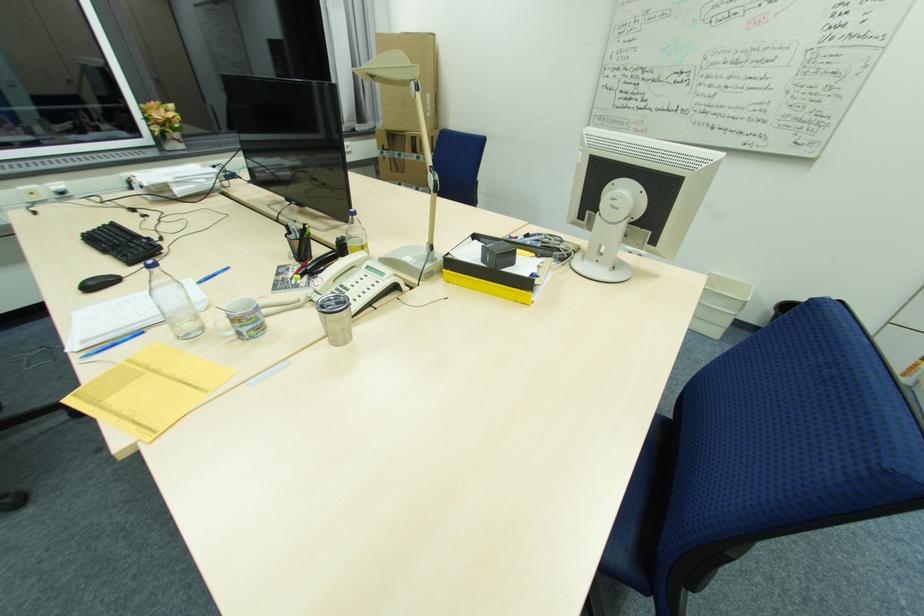
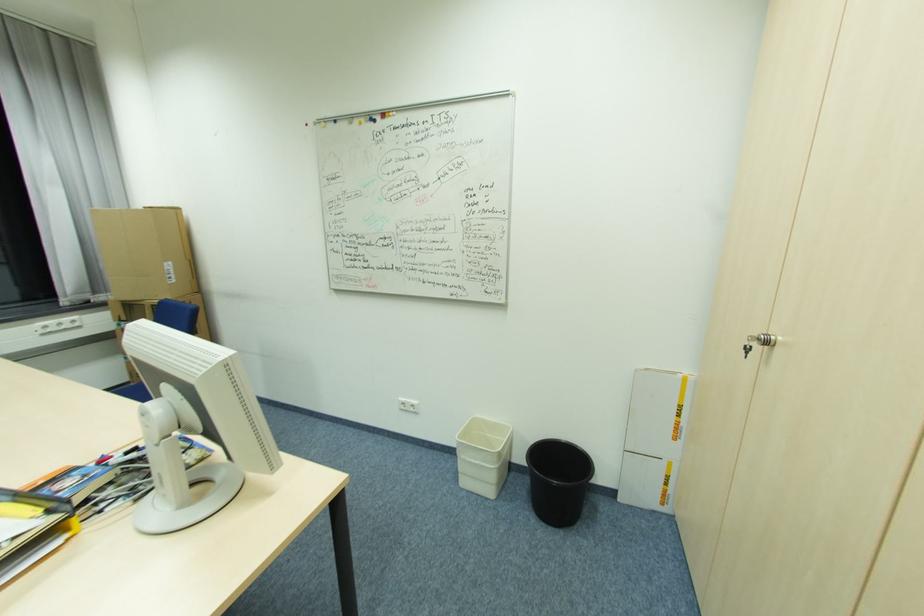
Locate, in the second image, the point that corresponds to (388,147) in the first image.

(127, 318)